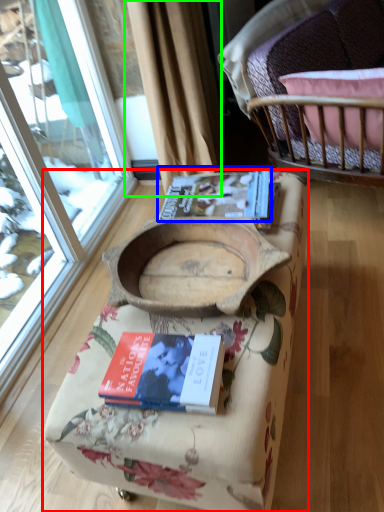
Question: Which object is the closest to the furniture (highlighted by a red box)? Choose among these: book (highlighted by a blue box) or curtain (highlighted by a green box).

Choices:
 (A) book
 (B) curtain

Answer: (A)